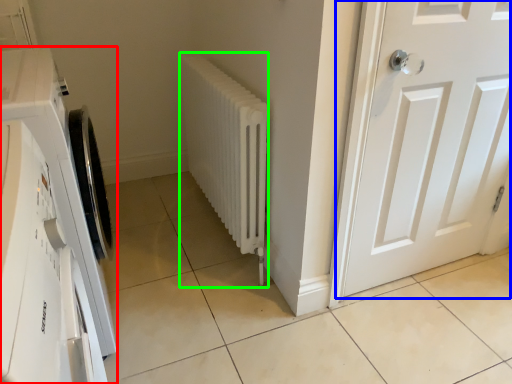
Question: Estimate the real-world distances between objects in this image. Which object is farther from washing machine (highlighted by a red box), door (highlighted by a blue box) or radiator (highlighted by a green box)?

Choices:
 (A) door
 (B) radiator

Answer: (A)